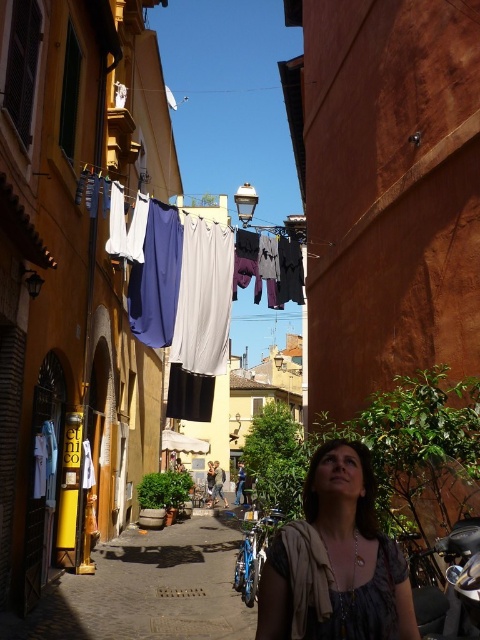
You are a photographer standing in the street scene. You want to take a photo of the matte gray blouse at center and the matte white fabric at center. If your camera has a maximum focus range of 5 meters, will both items be in focus at the same time?

The matte gray blouse at center is 5.73 meters from the matte white fabric at center. Since the distance between them exceeds the camera maximum focus range of 5 meters, they cannot be in focus simultaneously.

You are a tailor observing a woman wearing a matte gray blouse at center and holding a matte white fabric at center. Which item is shorter in height?

The matte gray blouse at center is not as tall as the matte white fabric at center, so the matte gray blouse at center is shorter in height.